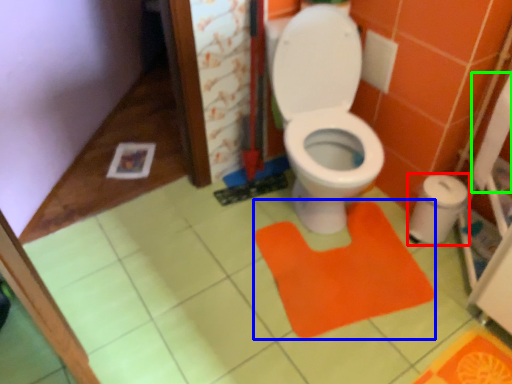
Question: Which object is positioned closest to potty (highlighted by a red box)? Select from doormat (highlighted by a blue box) and toilet paper (highlighted by a green box).

Choices:
 (A) doormat
 (B) toilet paper

Answer: (B)